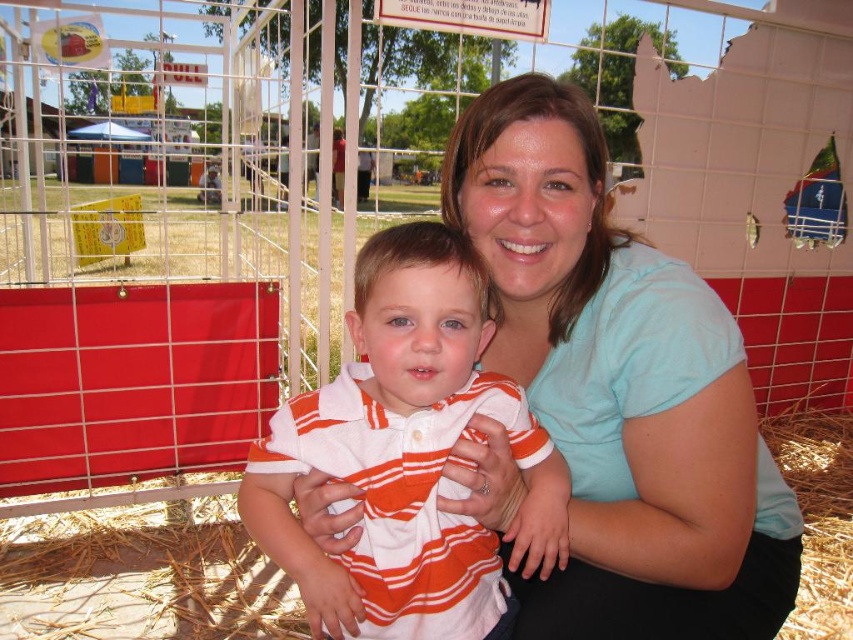
You are standing at the origin point in a coordinate system where the bottom left corner of the enclosure is the origin. The woman wearing the light blue shirt at center is standing at point 0.608, 0.728. If you want to walk straight towards her, in which direction should you move? Please provide your answer as either north, south, east, or west.

To move towards the light blue shirt at center located at coordinates (619, 388) from the origin, you should move east and north. Since the x coordinate is 0.608 and y is 0.728, moving east increases the x value and north increases the y value.

Looking at this image, you are a delivery robot with a height of 1.5 meters. You need to deliver a package to the light blue shirt at center. The path to them is clear except for a low gate that is 1.2 meters tall. Will you be able to pass under the gate without bending down?

The distance between the light blue shirt at center and the viewer is 1.09 meters, but the question is about the gate height. The gate is 1.2 meters tall, and the robot is 1.5 meters tall. Since the robot is taller than the gate, it cannot pass under without bending down.

You are a photographer trying to capture a photo of the light blue shirt at center and the orange striped polo shirt at center. Which shirt should you focus on first if you want to ensure both are in frame without moving the camera?

You should focus on the light blue shirt at center first because it is bigger than the orange striped polo shirt at center, ensuring it fits within the frame before adjusting for the smaller one.